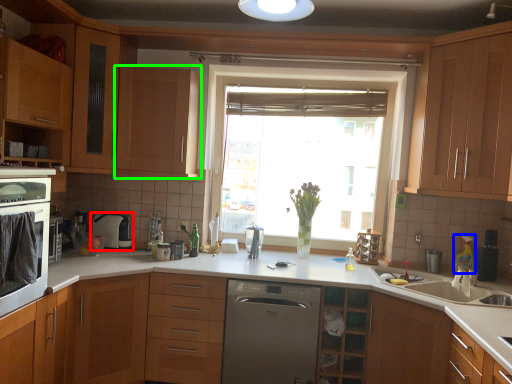
Question: Estimate the real-world distances between objects in this image. Which object is closer to appliance (highlighted by a red box), appliance (highlighted by a blue box) or cabinetry (highlighted by a green box)?

Choices:
 (A) appliance
 (B) cabinetry

Answer: (B)